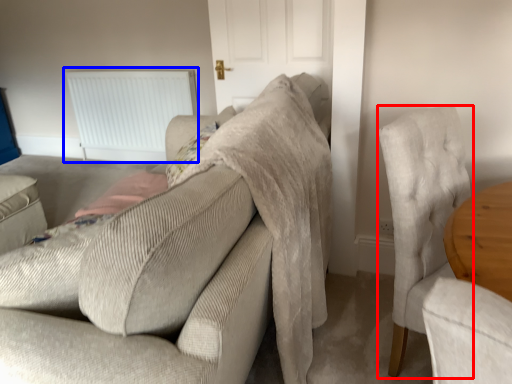
Question: Which object appears farthest to the camera in this image, chair (highlighted by a red box) or radiator (highlighted by a blue box)?

Choices:
 (A) chair
 (B) radiator

Answer: (B)